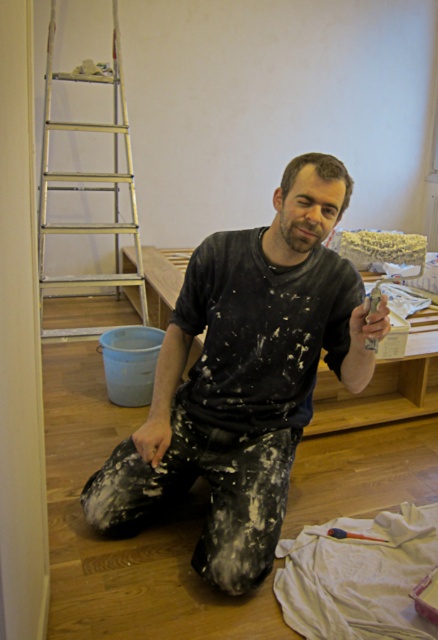
Question: Does black matte shirt at center have a larger size compared to silver metallic ladder at left?

Choices:
 (A) yes
 (B) no

Answer: (B)

Question: Does black matte shirt at center have a greater width compared to silver metallic ladder at left?

Choices:
 (A) no
 (B) yes

Answer: (B)

Question: Is black matte shirt at center bigger than silver metallic ladder at left?

Choices:
 (A) yes
 (B) no

Answer: (B)

Question: Which of the following is the farthest from the observer?

Choices:
 (A) (211, 554)
 (B) (42, 152)

Answer: (B)

Question: Which object appears farthest from the camera in this image?

Choices:
 (A) black matte shirt at center
 (B) silver metallic ladder at left

Answer: (B)